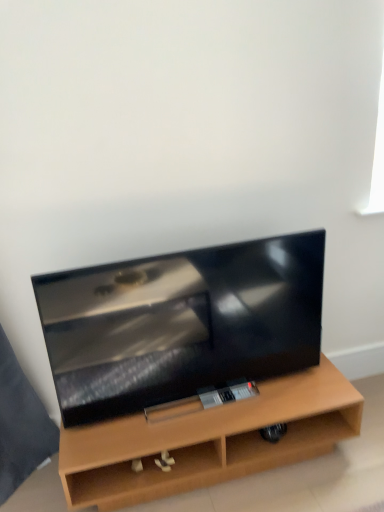
The width and height of the screenshot is (384, 512). What do you see at coordinates (180, 323) in the screenshot?
I see `matte black tv at center` at bounding box center [180, 323].

The image size is (384, 512). I want to click on matte black tv at center, so click(x=180, y=323).

I want to click on matte wood tv stand at center, so click(x=207, y=440).

In order to face matte wood tv stand at center, should I rotate leftwards or rightwards?

Rotate right and turn 2.520 degrees.

What do you see at coordinates (207, 440) in the screenshot? I see `matte wood tv stand at center` at bounding box center [207, 440].

Based on the photo, measure the distance between matte wood tv stand at center and camera.

matte wood tv stand at center is 1.50 meters from camera.

Locate an element on the screen. This screenshot has width=384, height=512. matte black tv at center is located at coordinates (180, 323).

Is matte black tv at center to the right of matte wood tv stand at center from the viewer's perspective?

Incorrect, matte black tv at center is not on the right side of matte wood tv stand at center.

Is matte black tv at center further to the viewer compared to matte wood tv stand at center?

No, it is in front of matte wood tv stand at center.

Considering the points (118, 273) and (159, 418), which point is behind, point (118, 273) or point (159, 418)?

The point (159, 418) is farther.

From the image's perspective, who appears lower, matte black tv at center or matte wood tv stand at center?

matte wood tv stand at center, from the image's perspective.

From a real-world perspective, which is physically below, matte black tv at center or matte wood tv stand at center?

From a 3D spatial view, matte wood tv stand at center is below.

Does matte black tv at center have a greater width compared to matte wood tv stand at center?

In fact, matte black tv at center might be narrower than matte wood tv stand at center.

Between matte black tv at center and matte wood tv stand at center, which one has more height?

matte black tv at center is taller.

Consider the image. Between matte black tv at center and matte wood tv stand at center, which one has smaller size?

Smaller between the two is matte black tv at center.

Is matte black tv at center not within matte wood tv stand at center?

Yes, matte black tv at center is not within matte wood tv stand at center.

Are matte black tv at center and matte wood tv stand at center making contact?

They are not placed beside each other.

Is matte black tv at center oriented away from matte wood tv stand at center?

No, matte black tv at center is not facing the opposite direction of matte wood tv stand at center.

How many degrees apart are the facing directions of matte black tv at center and matte wood tv stand at center?

They differ by 1.96 degrees in their facing directions.

Locate an element on the screen. furniture that appears on the right of matte black tv at center is located at coordinates (207, 440).

Which is more to the left, matte wood tv stand at center or matte black tv at center?

matte black tv at center is more to the left.

Which object is closer to the camera, matte wood tv stand at center or matte black tv at center?

matte black tv at center is closer to the camera.

Does point (114, 473) lie in front of point (298, 274)?

That is True.

From the image's perspective, does matte wood tv stand at center appear higher than matte black tv at center?

Actually, matte wood tv stand at center appears below matte black tv at center in the image.

From a real-world perspective, is matte wood tv stand at center located higher than matte black tv at center?

No.

Considering the relative sizes of matte wood tv stand at center and matte black tv at center in the image provided, is matte wood tv stand at center thinner than matte black tv at center?

Incorrect, the width of matte wood tv stand at center is not less than that of matte black tv at center.

Does matte wood tv stand at center have a lesser height compared to matte black tv at center?

Yes, matte wood tv stand at center is shorter than matte black tv at center.

Is matte wood tv stand at center bigger or smaller than matte black tv at center?

Clearly, matte wood tv stand at center is larger in size than matte black tv at center.

Can matte black tv at center be found inside matte wood tv stand at center?

No, matte black tv at center is not surrounded by matte wood tv stand at center.

Are matte wood tv stand at center and matte black tv at center located far from each other?

That's not correct — matte wood tv stand at center is a little close to matte black tv at center.

Is matte wood tv stand at center looking in the opposite direction of matte black tv at center?

matte wood tv stand at center is not turned away from matte black tv at center.

Measure the distance from matte wood tv stand at center to matte black tv at center.

The distance of matte wood tv stand at center from matte black tv at center is 10.99 inches.

Identify the location of television above the matte wood tv stand at center (from a real-world perspective). The width and height of the screenshot is (384, 512). (180, 323).

This screenshot has height=512, width=384. I want to click on furniture located underneath the matte black tv at center (from a real-world perspective), so click(x=207, y=440).

Locate an element on the screen. furniture on the right side of matte black tv at center is located at coordinates (207, 440).